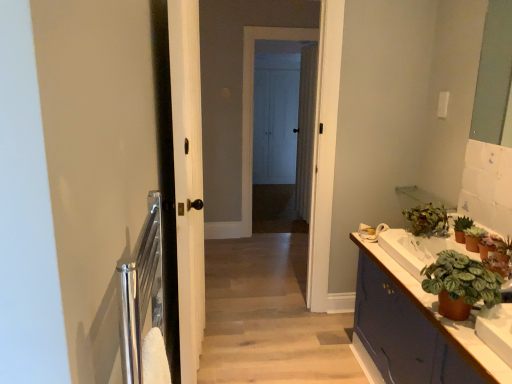
Question: Does white wood door at center have a smaller size compared to white wood screen door at center, which appears as the 2th screen door when viewed from the front?

Choices:
 (A) no
 (B) yes

Answer: (A)

Question: Is white wood door at center directly adjacent to white wood screen door at center, the first screen door from the back?

Choices:
 (A) no
 (B) yes

Answer: (A)

Question: Is white wood door at center to the right of white wood screen door at center, which appears as the 2th screen door when viewed from the front, from the viewer's perspective?

Choices:
 (A) no
 (B) yes

Answer: (A)

Question: Can you confirm if white wood door at center is taller than white wood screen door at center, which appears as the 2th screen door when viewed from the front?

Choices:
 (A) no
 (B) yes

Answer: (A)

Question: Is white wood door at center not close to white wood screen door at center, which appears as the 2th screen door when viewed from the front?

Choices:
 (A) yes
 (B) no

Answer: (A)

Question: Considering the relative positions of white wood door at center and white wood screen door at center, the first screen door from the back, in the image provided, is white wood door at center to the left of white wood screen door at center, the first screen door from the back, from the viewer's perspective?

Choices:
 (A) no
 (B) yes

Answer: (B)

Question: Can you confirm if matte purple cabinet at right is positioned to the left of white wood screen door at center, which is counted as the 1th screen door, starting from the front?

Choices:
 (A) no
 (B) yes

Answer: (A)

Question: Considering the relative sizes of matte purple cabinet at right and white wood screen door at center, which is counted as the 1th screen door, starting from the front, in the image provided, is matte purple cabinet at right bigger than white wood screen door at center, which is counted as the 1th screen door, starting from the front,?

Choices:
 (A) yes
 (B) no

Answer: (A)

Question: Is matte purple cabinet at right not inside white wood screen door at center, which is counted as the 1th screen door, starting from the front?

Choices:
 (A) no
 (B) yes

Answer: (B)

Question: From a real-world perspective, is matte purple cabinet at right over white wood screen door at center, which is counted as the second screen door, starting from the back?

Choices:
 (A) yes
 (B) no

Answer: (B)

Question: Is matte purple cabinet at right turned away from white wood screen door at center, which is counted as the second screen door, starting from the back?

Choices:
 (A) yes
 (B) no

Answer: (B)

Question: Considering the relative sizes of matte purple cabinet at right and white wood screen door at center, which is counted as the second screen door, starting from the back, in the image provided, is matte purple cabinet at right wider than white wood screen door at center, which is counted as the second screen door, starting from the back,?

Choices:
 (A) yes
 (B) no

Answer: (A)

Question: From a real-world perspective, is matte purple cabinet at right over green matte plant at right, the 4th houseplant viewed from the back?

Choices:
 (A) yes
 (B) no

Answer: (B)